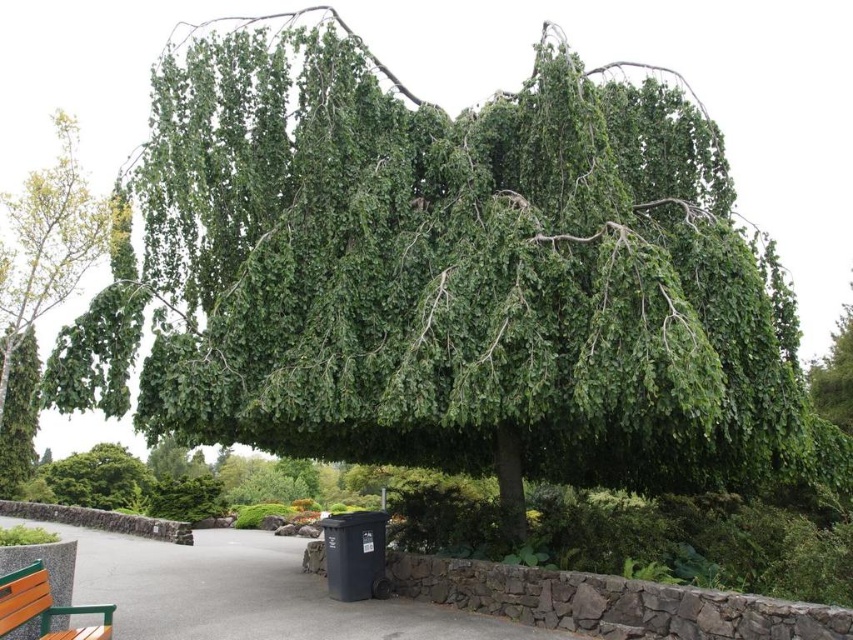
Question: Is green leafy tree at left above wooden bench at lower left?

Choices:
 (A) yes
 (B) no

Answer: (A)

Question: Which of the following is the farthest from the observer?

Choices:
 (A) gray asphalt path at center
 (B) wooden bench at lower left

Answer: (A)

Question: Is gray asphalt path at center further to the viewer compared to wooden bench at lower left?

Choices:
 (A) yes
 (B) no

Answer: (A)

Question: Does gray asphalt path at center have a greater width compared to wooden bench at lower left?

Choices:
 (A) yes
 (B) no

Answer: (A)

Question: Among these objects, which one is farthest from the camera?

Choices:
 (A) wooden bench at lower left
 (B) gray asphalt path at center
 (C) green leafy tree at left

Answer: (C)

Question: Which of the following is the farthest from the observer?

Choices:
 (A) green leafy tree at left
 (B) gray asphalt path at center
 (C) wooden bench at lower left

Answer: (A)